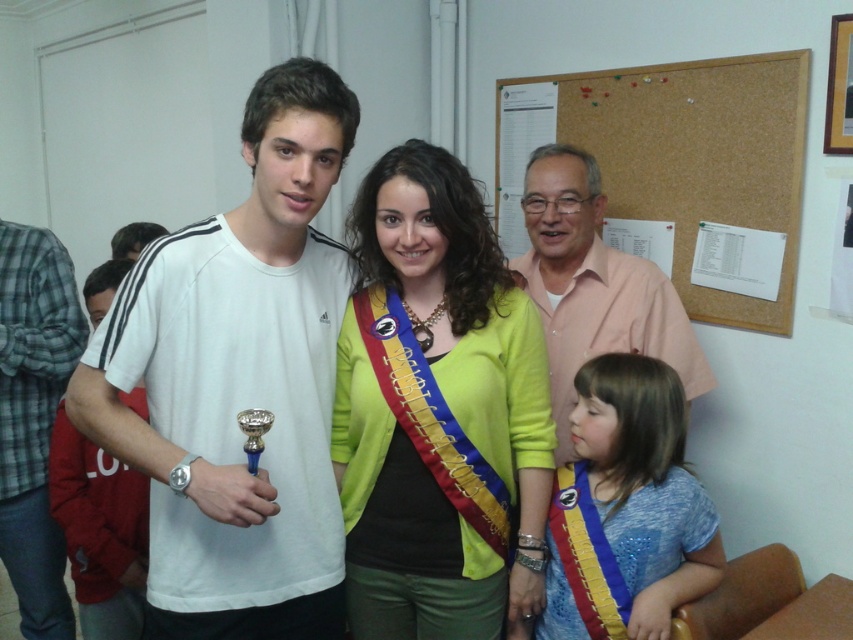
Question: Which object appears farthest from the camera in this image?

Choices:
 (A) white cotton t-shirt at left
 (B) pink cotton shirt at center

Answer: (A)

Question: Is blue satin sash at lower right smaller than white cotton t-shirt at left?

Choices:
 (A) yes
 (B) no

Answer: (A)

Question: Observing the image, what is the correct spatial positioning of white matte t-shirt at center in reference to corkboard at upper right?

Choices:
 (A) below
 (B) above

Answer: (A)

Question: Which point appears closest to the camera in this image?

Choices:
 (A) (720, 129)
 (B) (544, 285)
 (C) (428, 282)

Answer: (C)

Question: Which point is closer to the camera taking this photo?

Choices:
 (A) (468, 554)
 (B) (682, 342)
 (C) (77, 573)
 (D) (636, 388)

Answer: (A)

Question: Does white cotton t-shirt at left have a lesser width compared to white cotton shirt at left?

Choices:
 (A) no
 (B) yes

Answer: (B)